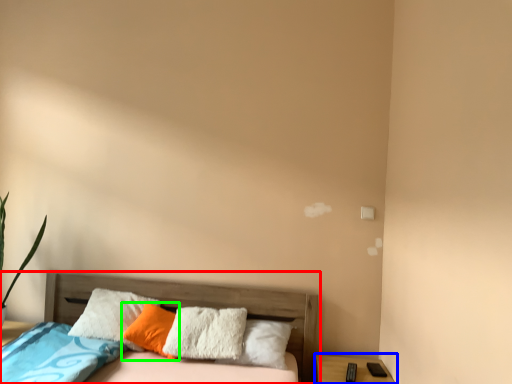
Question: Estimate the real-world distances between objects in this image. Which object is closer to bed (highlighted by a red box), nightstand (highlighted by a blue box) or pillow (highlighted by a green box)?

Choices:
 (A) nightstand
 (B) pillow

Answer: (B)